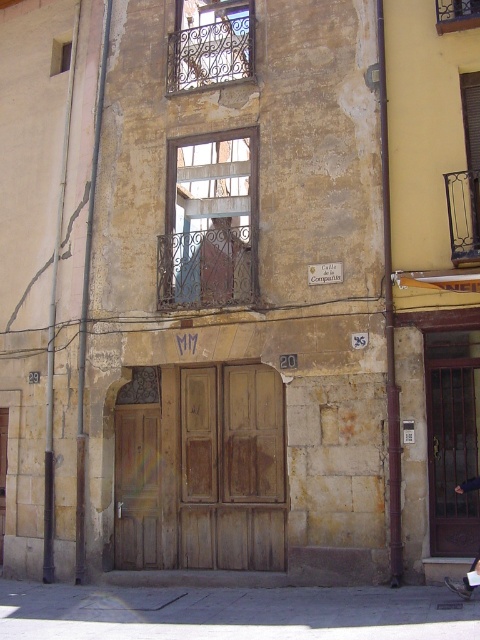
Between wooden door at center and rusty metal window at center, which one is positioned higher?

rusty metal window at center is higher up.

Describe the element at coordinates (203, 472) in the screenshot. This screenshot has height=640, width=480. I see `wooden door at center` at that location.

Is point (147, 410) positioned before point (206, 291)?

No, it is behind (206, 291).

Image resolution: width=480 pixels, height=640 pixels. In order to click on wooden door at center in this screenshot , I will do `click(203, 472)`.

Who is more forward, (157,538) or (456,8)?

Positioned in front is point (456,8).

Is wooden door at center shorter than metallic wire mesh window at upper center?

In fact, wooden door at center may be taller than metallic wire mesh window at upper center.

Who is more distant from viewer, [260,392] or [448,28]?

The point [260,392] is more distant.

This screenshot has width=480, height=640. Find the location of `wooden door at center`. wooden door at center is located at coordinates (203, 472).

Which is above, rusty metal window at center or wrought iron window at upper center?

wrought iron window at upper center

Is point (227, 292) positioned after point (192, 4)?

No, (227, 292) is in front of (192, 4).

The image size is (480, 640). Identify the location of rusty metal window at center. (210, 221).